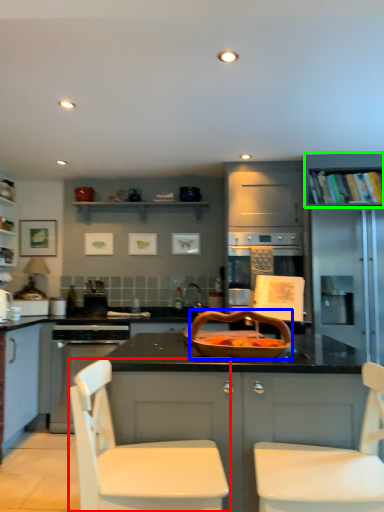
Question: Which is nearer to the chair (highlighted by a red box)? basket (highlighted by a blue box) or shelf (highlighted by a green box).

Choices:
 (A) basket
 (B) shelf

Answer: (A)